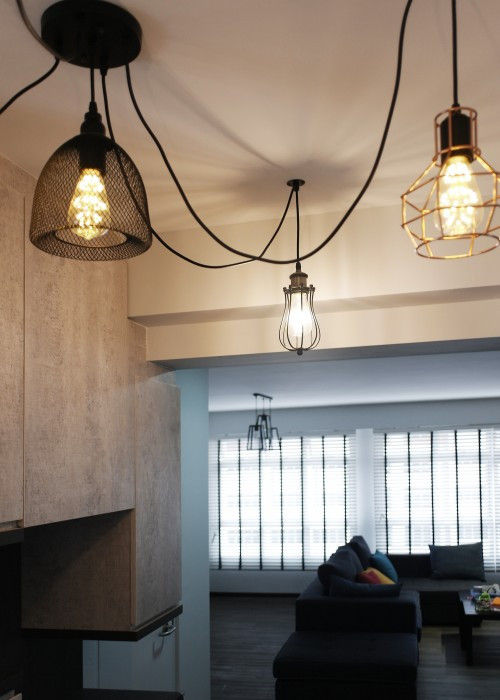
Identify the location of blinds. (314, 505).